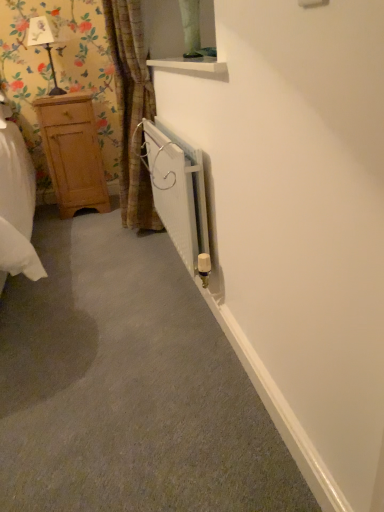
Image resolution: width=384 pixels, height=512 pixels. I want to click on free space underneath white metallic radiator at center (from a real-world perspective), so click(x=184, y=286).